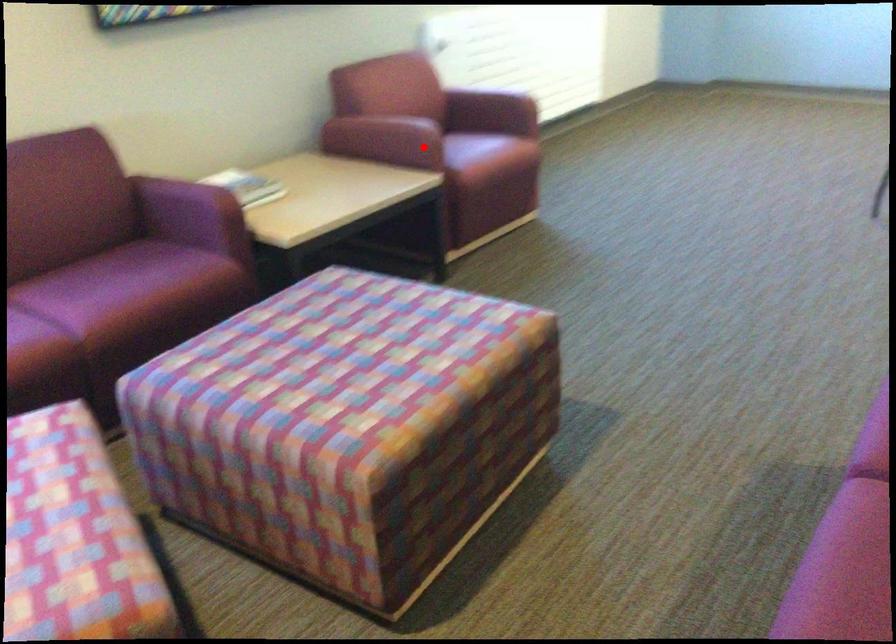
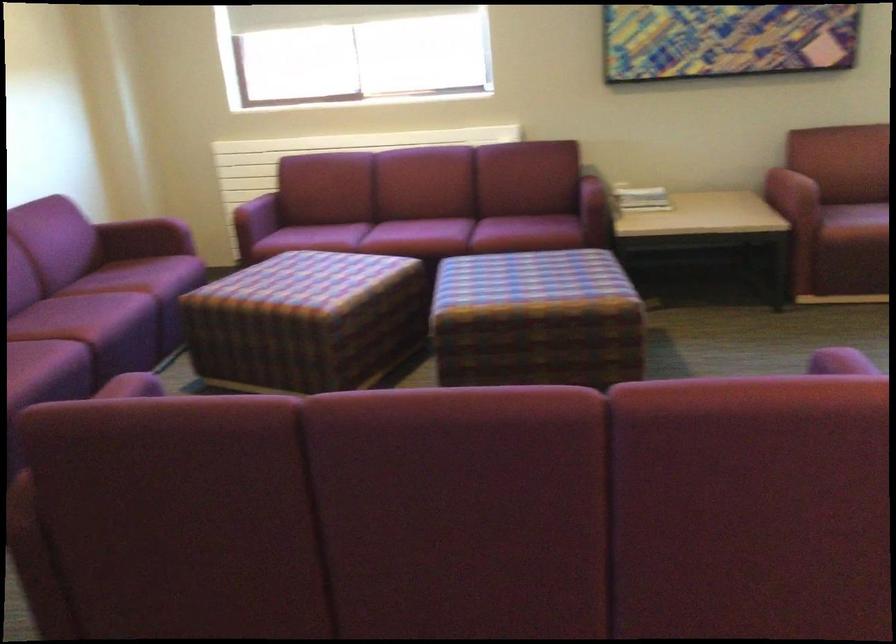
Where in the second image is the point corresponding to the highlighted location from the first image?

(791, 194)